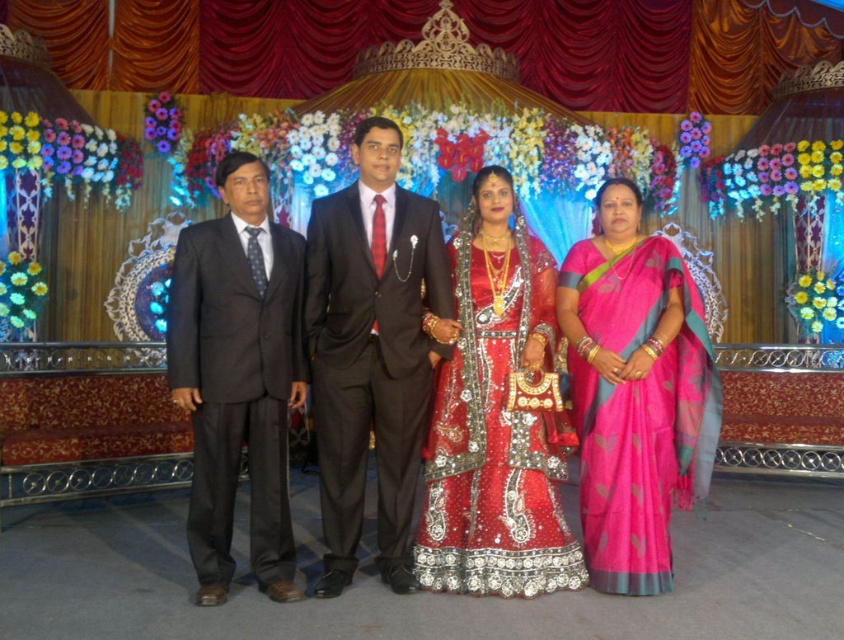
You are a photographer at the event and want to capture the shiny black suit at center and the red sequined lehenga at center in a single shot. Which of the two is covering more of the background?

The shiny black suit at center is positioned over the red sequined lehenga at center, so it covers more of the background.

You are a photographer at this event. You need to position a backdrop that is 1.8 meters tall to ensure both the shiny black suit at center and the red sequined lehenga at center are fully visible. Will the backdrop be tall enough?

The shiny black suit at center is taller than the red sequined lehenga at center. Since the backdrop is 1.8 meters tall, it will be sufficient to capture both individuals as long as their heights do not exceed this measurement. However, without specific height data, we can only confirm the backdrop is tall enough if the taller individual, the shiny black suit at center, is within the 1.8 meters limit.

You are a photographer at the event and need to frame both the shiny black suit at center and the red sequined lehenga at center in a single shot. Which of the two requires more space in the frame to accommodate its width?

The shiny black suit at center requires more space in the frame because its width is larger than the red sequined lehenga at center.